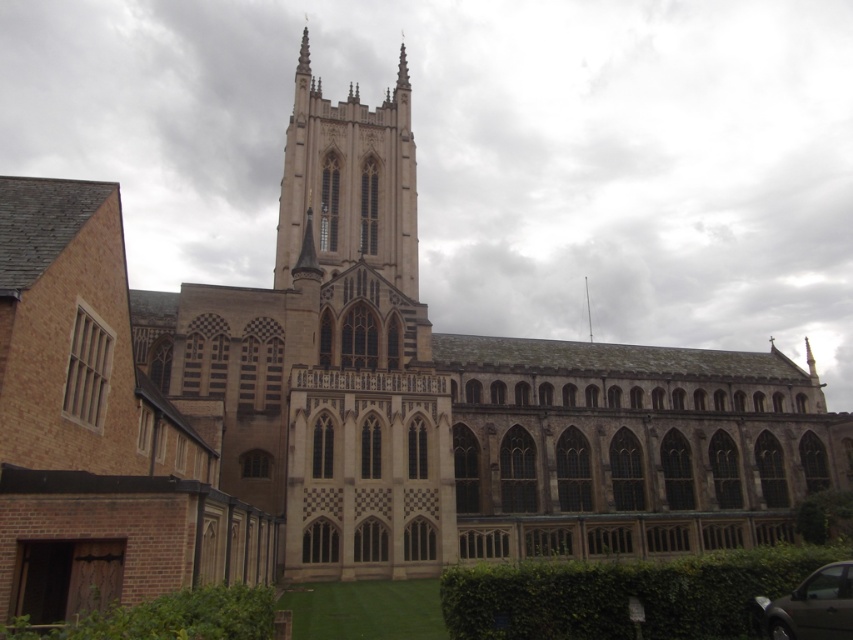
Question: Which object appears farthest from the camera in this image?

Choices:
 (A) metallic silver car at lower right
 (B) beige stone tower at center

Answer: (B)

Question: From the image, what is the correct spatial relationship of beige stone tower at center in relation to metallic silver car at lower right?

Choices:
 (A) above
 (B) below

Answer: (A)

Question: Can you confirm if beige stone tower at center is wider than metallic silver car at lower right?

Choices:
 (A) no
 (B) yes

Answer: (B)

Question: Is the position of beige stone tower at center more distant than that of metallic silver car at lower right?

Choices:
 (A) yes
 (B) no

Answer: (A)

Question: Which point is farther from the camera taking this photo?

Choices:
 (A) (766, 625)
 (B) (357, 90)

Answer: (B)